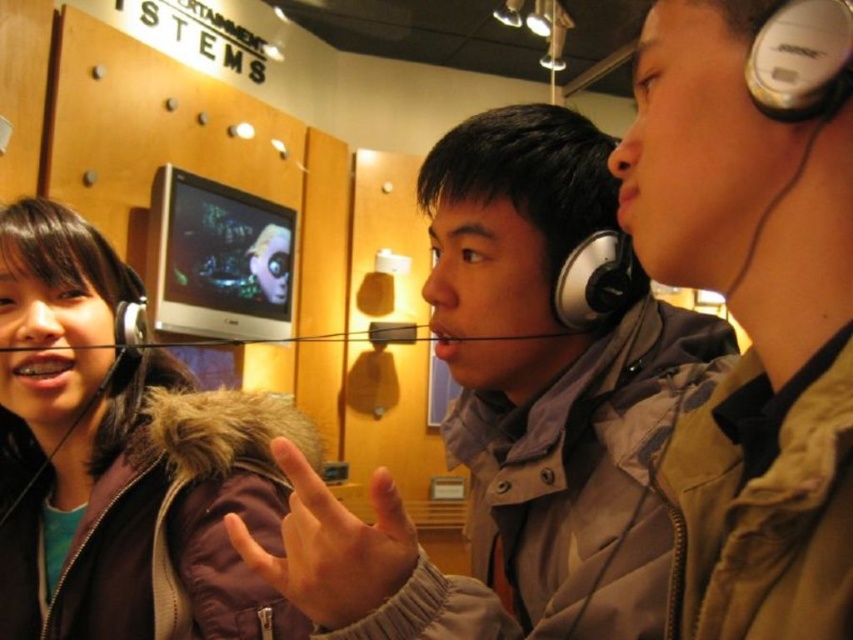
Please describe the position of the brown fuzzy jacket at left in terms of coordinates within the image. The image has a coordinate system where the bottom left corner is the origin point. The coordinates are given as a pair of numbers between 0 and 1, with the first number representing the horizontal axis and the second number representing the vertical axis. The horizontal axis increases to the right, and the vertical axis increases upward. The coordinates are normalized such that the entire image is a 1x1

The brown fuzzy jacket at left is located at coordinates approximately 0.720 on the horizontal axis and 0.144 on the vertical axis.

You are a store employee who needs to place a new display stand that is 1.2 meters tall. The stand must be placed between the brown fuzzy jacket at left and the matte silver earphone at left. Can the display stand fit vertically between them?

The brown fuzzy jacket at left is taller than matte silver earphone at left. Since the display stand is 1.2 meters tall, it depends on the height of the brown fuzzy jacket. If the jacket is taller than 1.2 meters, the stand can fit. However, without specific measurements, we cannot confirm. Please check the actual height of the jacket.

You are standing in the retail store and need to locate the brown fuzzy jacket at left. According to the coordinates given, where would you find it?

The brown fuzzy jacket at left is located at coordinates point [122,460].